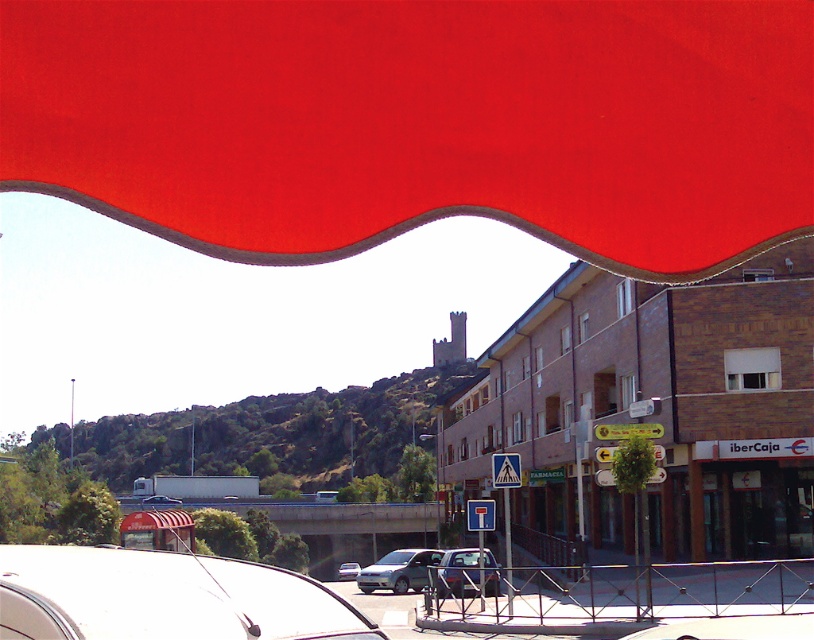
In the scene shown: You are a pedestrian standing on the sidewalk and want to take a photo of the matte red awning at upper center and the matte silver van at center. Which object should you frame first in your camera viewfinder to ensure both are visible in the shot?

The matte silver van at center should be framed first because the matte red awning at upper center is positioned on the right side of it, so centering the van first allows the awning to be captured to its right in the frame.

You are standing at the point marked by the coordinates (456, 572) in the image. What object are you directly facing?

The point corresponds to the metallic silver car at center, so you are directly facing the metallic silver car at center.

You are standing on the street looking at the scene under the bright red awning. There are two points marked in the image, one at coordinates point (174, 22) and another at point (421, 580). Which of these two points is closer to you?

Point (174, 22) is closer to the viewer than point (421, 580).